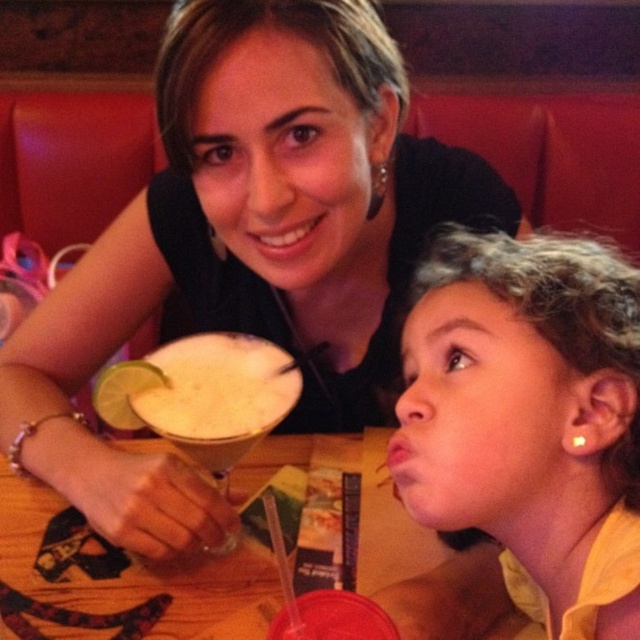
Does matte yellow shirt at center have a lesser height compared to wooden table at center?

No.

Between matte yellow shirt at center and wooden table at center, which one is positioned lower?

wooden table at center is below.

What do you see at coordinates (522, 397) in the screenshot? I see `matte yellow shirt at center` at bounding box center [522, 397].

Where is `matte yellow shirt at center`? matte yellow shirt at center is located at coordinates (522, 397).

Can you confirm if matte black dress at center is positioned below matte yellow shirt at center?

Incorrect, matte black dress at center is not positioned below matte yellow shirt at center.

Describe the element at coordinates (248, 246) in the screenshot. The height and width of the screenshot is (640, 640). I see `matte black dress at center` at that location.

The width and height of the screenshot is (640, 640). Find the location of `matte black dress at center`. matte black dress at center is located at coordinates (248, 246).

Does point (269, 17) lie behind point (228, 368)?

No, (269, 17) is in front of (228, 368).

Who is more distant from viewer, (116, 480) or (211, 355)?

The point (211, 355) is more distant.

This screenshot has height=640, width=640. In order to click on matte black dress at center in this screenshot , I will do `click(248, 246)`.